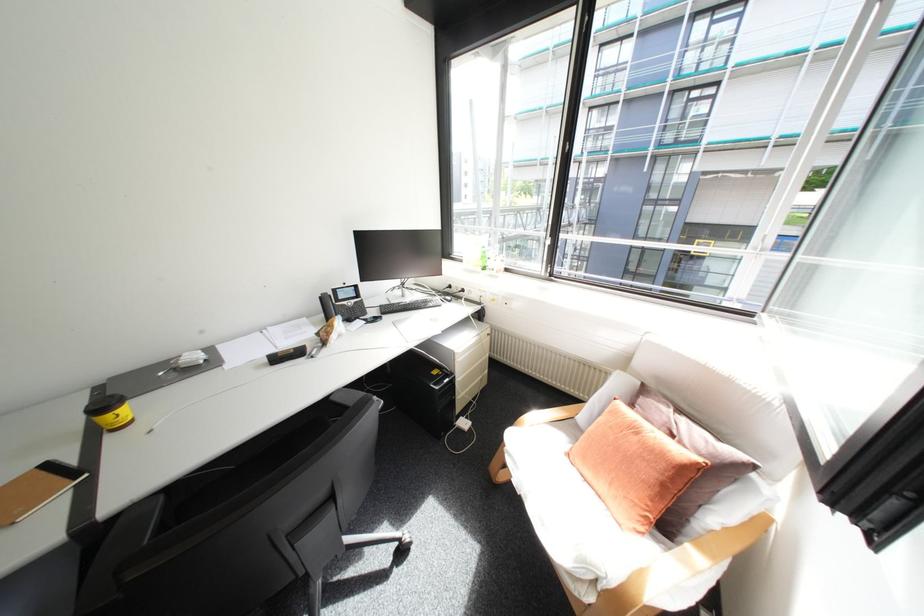
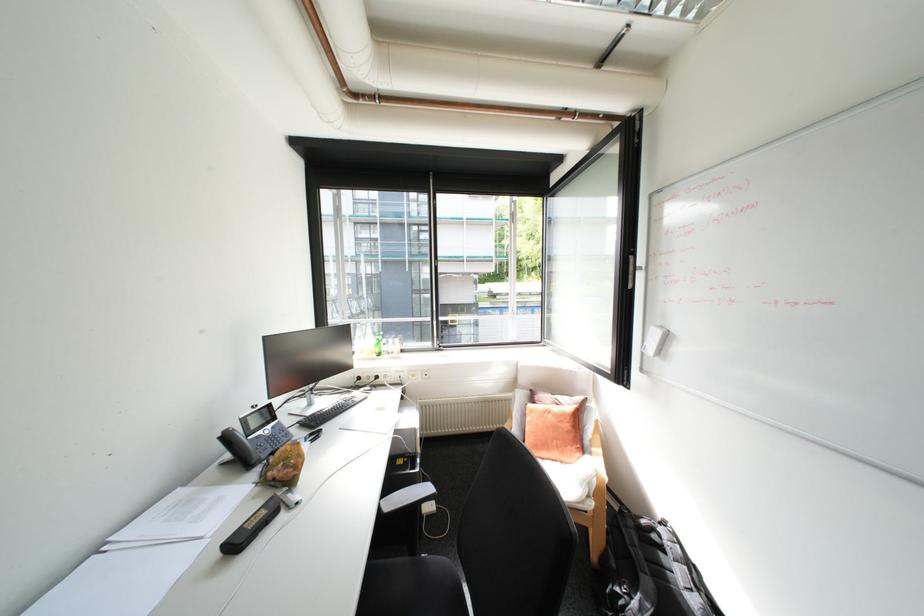
In the second image, find the point that corresponds to point 645,439 in the first image.

(561, 416)